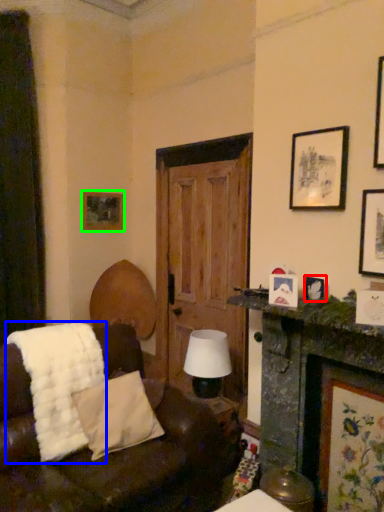
Question: Estimate the real-world distances between objects in this image. Which object is closer to picture frame (highlighted by a red box), blanket (highlighted by a blue box) or picture frame (highlighted by a green box)?

Choices:
 (A) blanket
 (B) picture frame

Answer: (A)